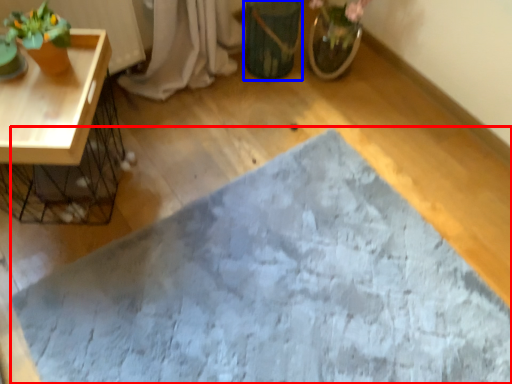
Question: Which object is closer to the camera taking this photo, bath mat (highlighted by a red box) or flowerpot (highlighted by a blue box)?

Choices:
 (A) bath mat
 (B) flowerpot

Answer: (A)